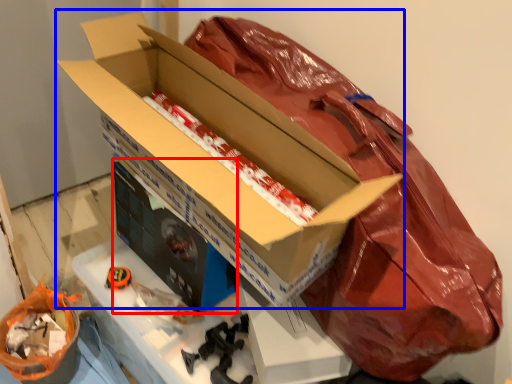
Question: Among these objects, which one is farthest to the camera, box (highlighted by a red box) or box (highlighted by a blue box)?

Choices:
 (A) box
 (B) box

Answer: (A)